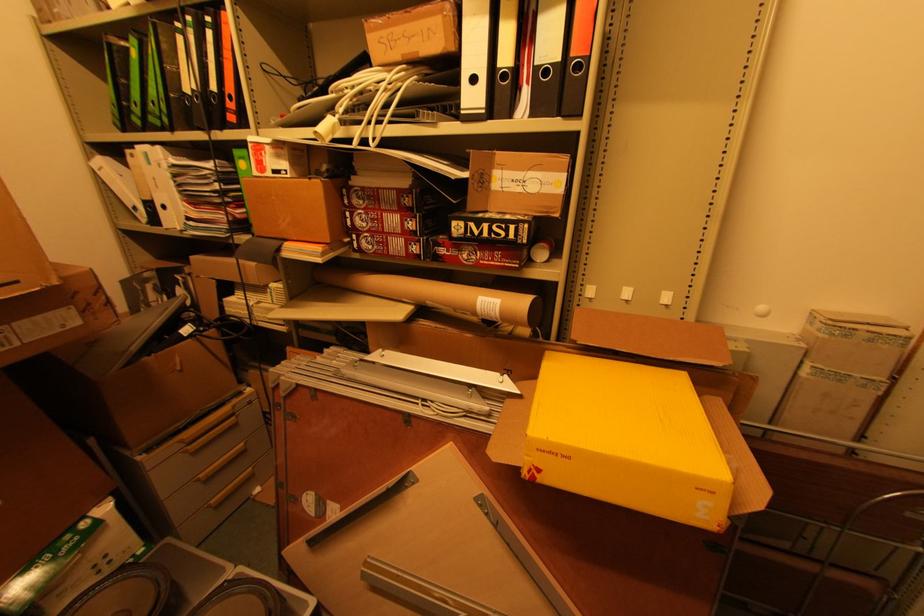
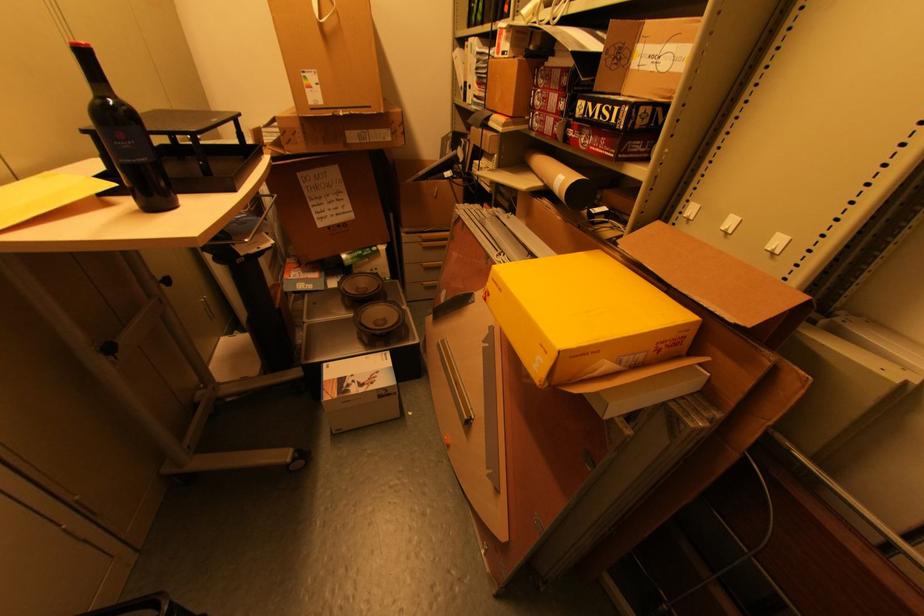
Locate, in the second image, the point that corresponds to point (204, 477) in the first image.

(428, 265)